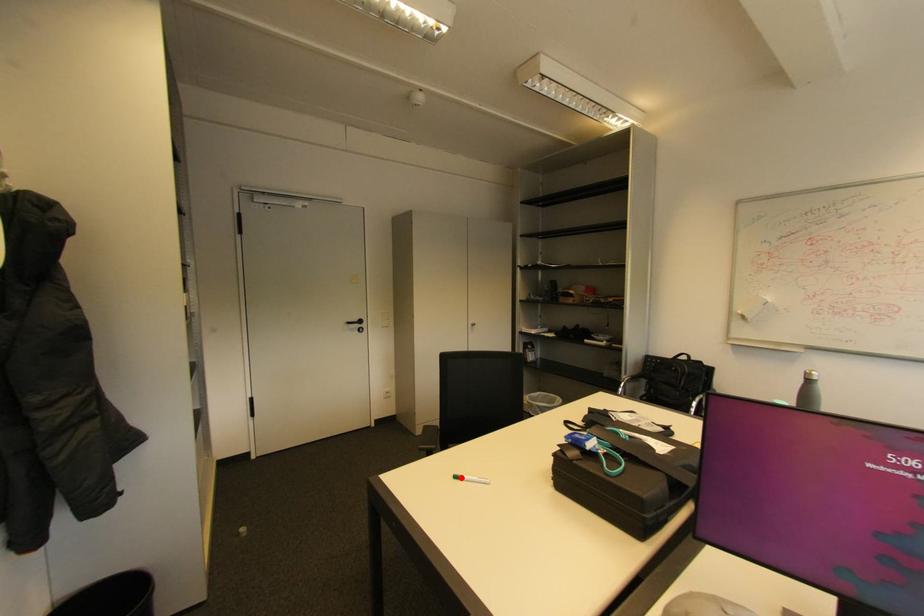
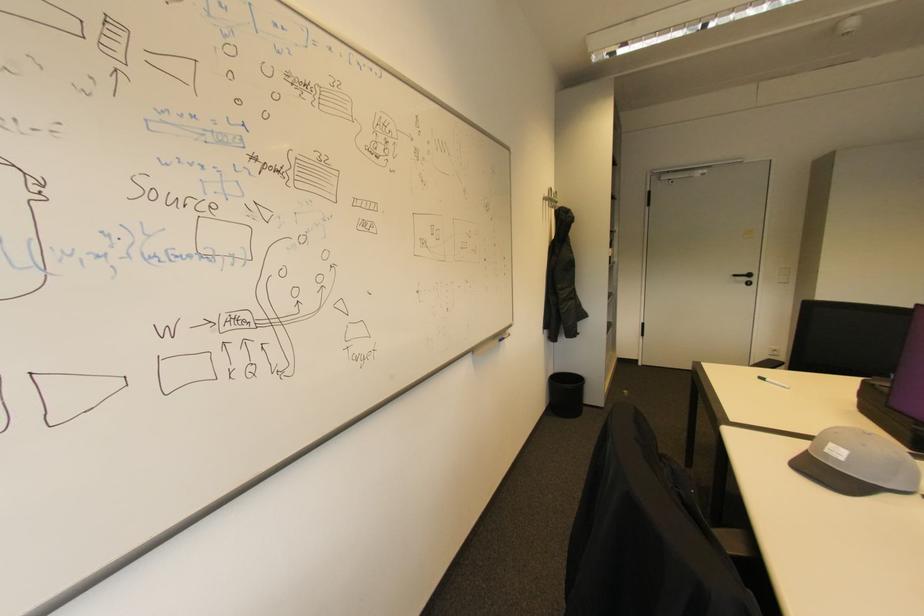
Locate, in the second image, the point that corresponds to the highlighted location in the first image.

(768, 379)